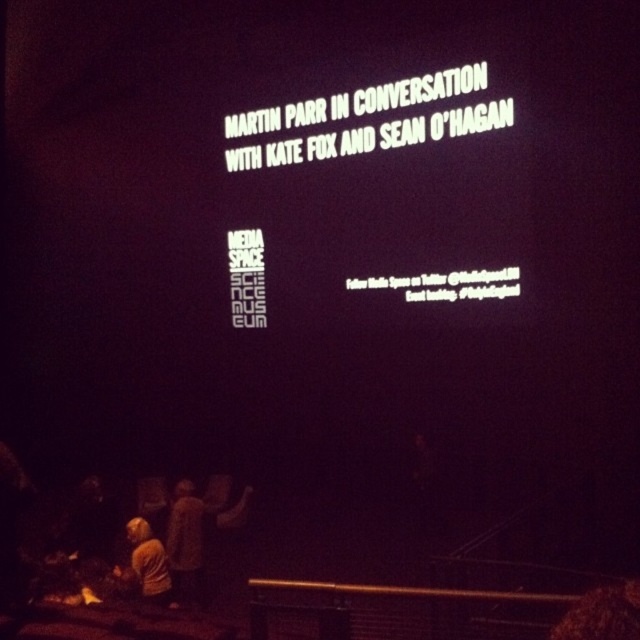
Which is more to the right, white text on black screen at center or yellow fabric at lower left?

white text on black screen at center is more to the right.

Who is taller, white text on black screen at center or yellow fabric at lower left?

white text on black screen at center

Is point (477, 186) positioned after point (138, 561)?

Yes, point (477, 186) is farther from viewer.

Image resolution: width=640 pixels, height=640 pixels. I want to click on white text on black screen at center, so click(410, 179).

In the scene shown: Which of these two, white text on black screen at center or dark brown fabric at lower left, stands taller?

white text on black screen at center

Where is `white text on black screen at center`? The width and height of the screenshot is (640, 640). white text on black screen at center is located at coordinates [x=410, y=179].

Does point (202, 566) come behind point (152, 572)?

Yes, point (202, 566) is behind point (152, 572).

Can you confirm if dark brown fabric at lower left is positioned to the left of yellow fabric at lower left?

→ No, dark brown fabric at lower left is not to the left of yellow fabric at lower left.

Where is `dark brown fabric at lower left`? dark brown fabric at lower left is located at coordinates (195, 536).